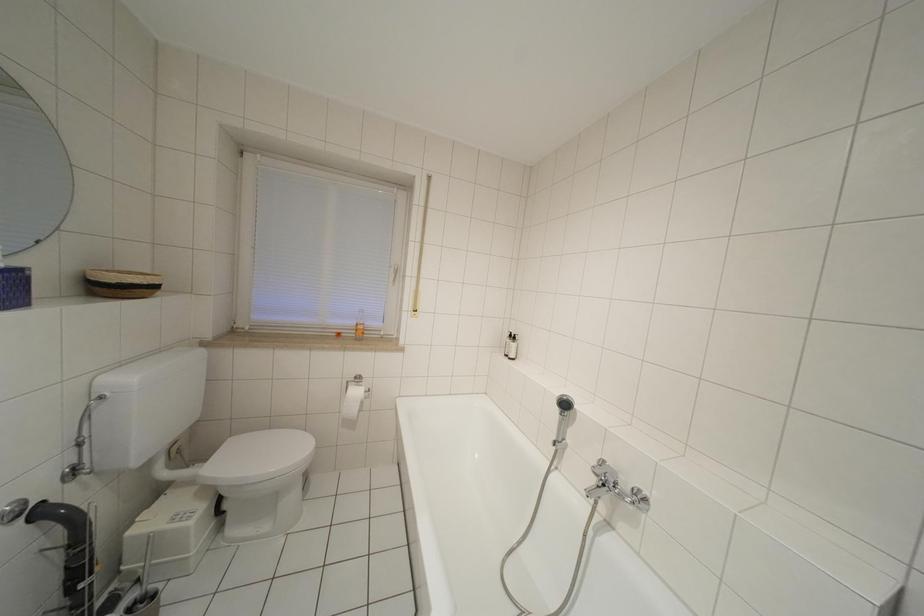
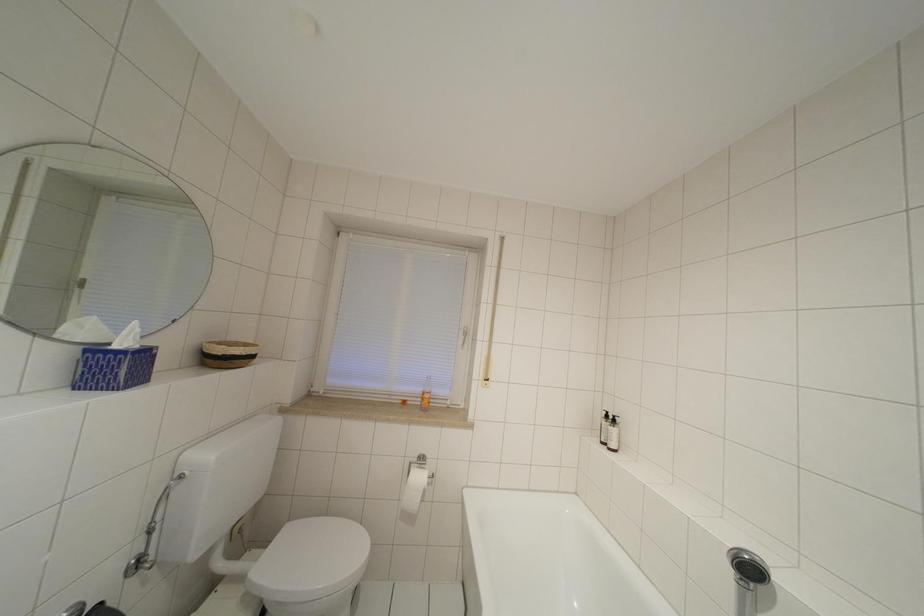
In a continuous first-person perspective shot, in which direction is the camera moving?

The movement direction of the cameraman is left, forward.